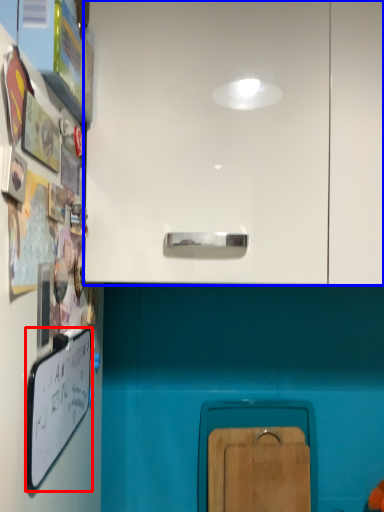
Question: Which object is further to the camera taking this photo, whiteboard (highlighted by a red box) or cabinetry (highlighted by a blue box)?

Choices:
 (A) whiteboard
 (B) cabinetry

Answer: (B)